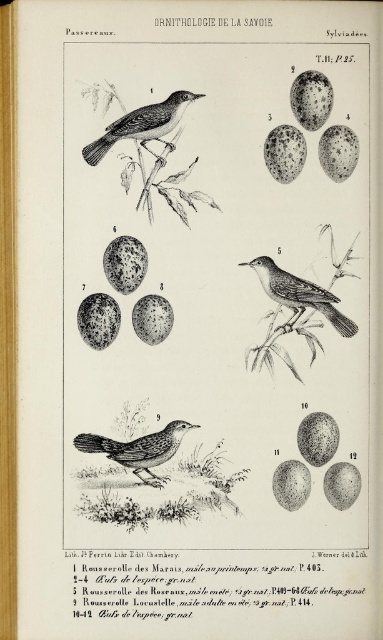
You are a researcher examining the page from the book. The brown textured bird at center is part of your study. Can you determine its exact location on the page using the coordinate system provided?

The brown textured bird at center is located at coordinate point (139, 449).

Looking at this image, you are a researcher examining the page from the book. You notice two birds depicted on the page. The first is a brown textured bird at center, and the second is a smooth brown bird at upper center. From the perspective of someone looking at the page, which bird appears closer to the viewer?

The brown textured bird at center appears closer to the viewer because the smooth brown bird at upper center is positioned behind it.